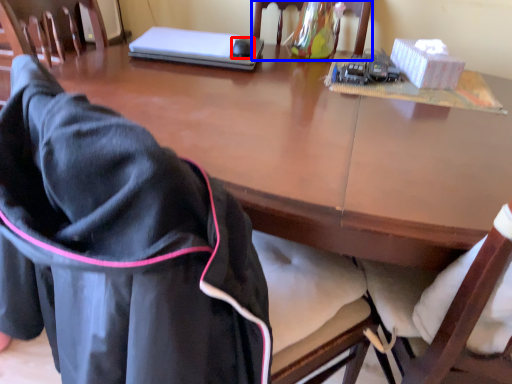
Question: Among these objects, which one is farthest to the camera, mouse (highlighted by a red box) or chair (highlighted by a blue box)?

Choices:
 (A) mouse
 (B) chair

Answer: (A)